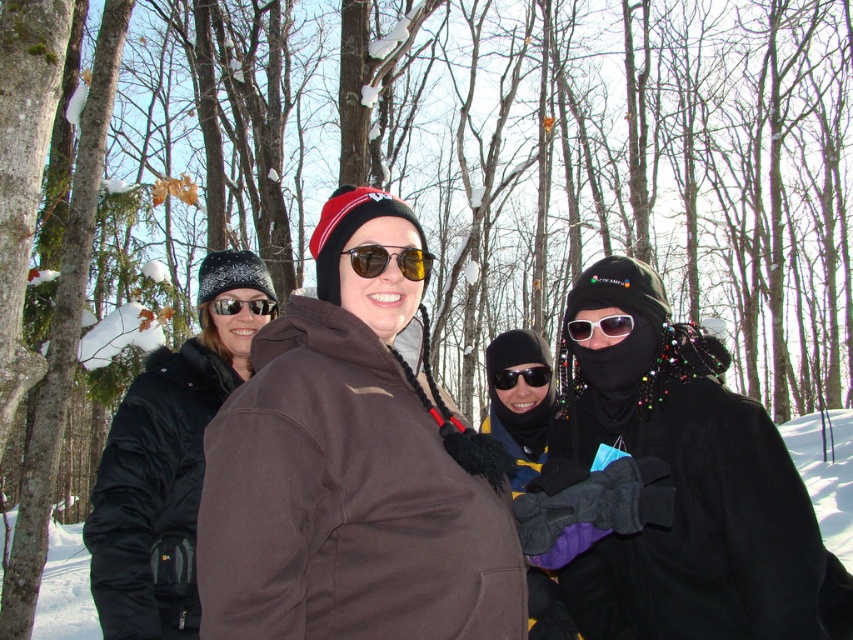
You are a photographer trying to capture a clear shot of the black reflective sunglasses at center. However, the black fuzzy jacket at left is blocking your view. Can you estimate whether the jacket is large enough to completely obscure the sunglasses from your current angle?

The black fuzzy jacket at left is larger in size than the black reflective sunglasses at center, so it is likely blocking the view of the sunglasses completely.

You are one of the people in the snowy forest scene. You want to hand a map to the person wearing the black reflective sunglasses at center. Since you are wearing the black fuzzy jacket at left, can you reach them without moving from your current position?

The black fuzzy jacket at left is in front of the black reflective sunglasses at center, so you can reach them without moving from your current position.

You are an observer standing in the snowy forest scene. You notice the black fuzzy jacket at left and the yellow reflective sunglasses at center. Which object is closer to you?

The black fuzzy jacket at left is closer to you because the yellow reflective sunglasses at center is behind it.